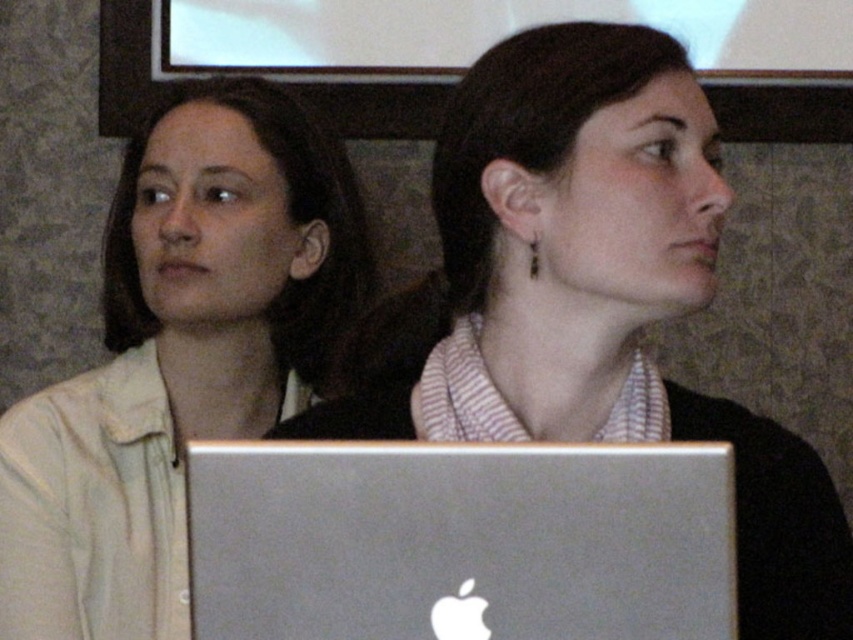
Find the location of a particular element. metallic silver laptop at center is located at coordinates (608, 291).

Does metallic silver laptop at center have a lesser width compared to silver metallic laptop at center?

Incorrect, metallic silver laptop at center's width is not less than silver metallic laptop at center's.

Locate an element on the screen. The image size is (853, 640). metallic silver laptop at center is located at coordinates (608, 291).

Locate an element on the screen. metallic silver laptop at center is located at coordinates (608, 291).

Is matte beige shirt at left above silver metallic laptop at center?

Yes.

Between point (68, 493) and point (462, 621), which one is positioned behind?

Point (68, 493)

Between point (306, 285) and point (247, 570), which one is positioned in front?

Point (247, 570) is more forward.

You are a GUI agent. You are given a task and a screenshot of the screen. Output one action in this format:
    pyautogui.click(x=<x>, y=<y>)
    Task: Click on the matte beige shirt at left
    This screenshot has width=853, height=640.
    Given the screenshot: What is the action you would take?
    pyautogui.click(x=177, y=356)

This screenshot has height=640, width=853. Identify the location of metallic silver laptop at center. (608, 291).

What do you see at coordinates (608, 291) in the screenshot?
I see `metallic silver laptop at center` at bounding box center [608, 291].

Locate an element on the screen. This screenshot has height=640, width=853. metallic silver laptop at center is located at coordinates (608, 291).